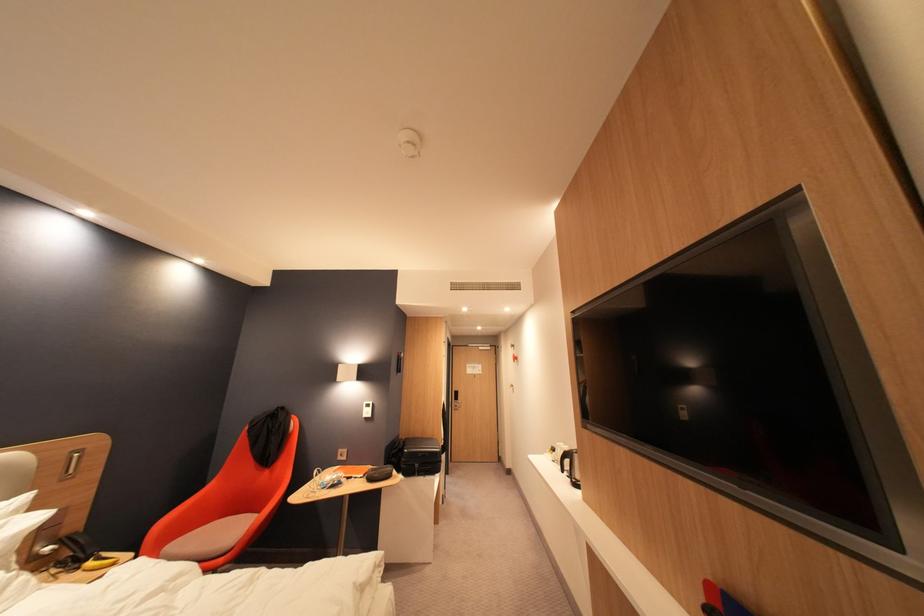
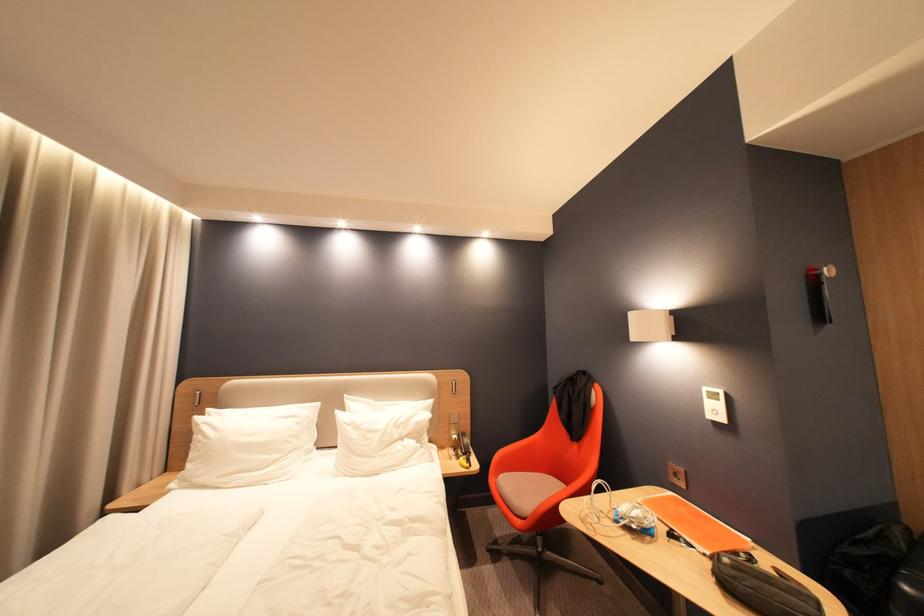
The point at (44, 493) is marked in the first image. Where is the corresponding point in the second image?

(443, 400)